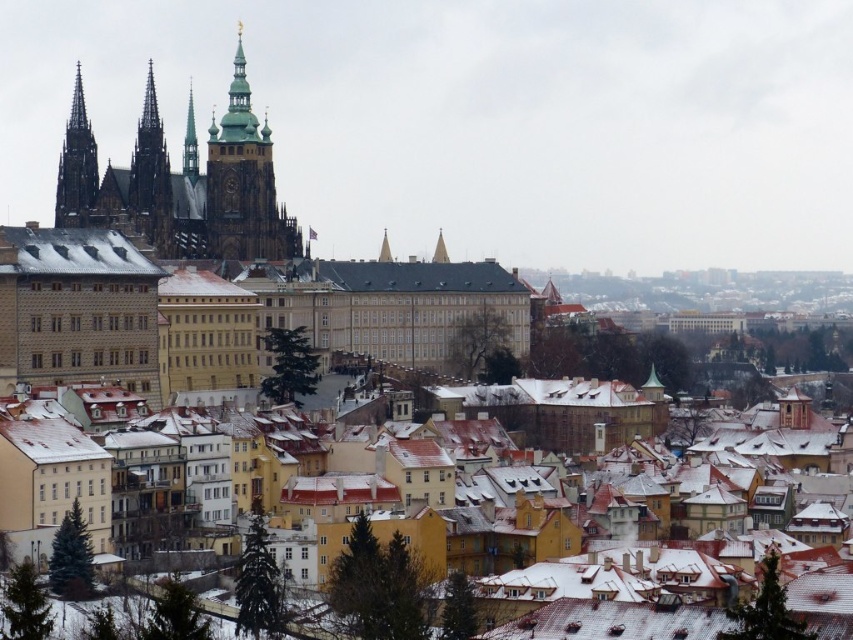
Question: Can you confirm if green stone tower at center is positioned below dark gray stone spire at upper left?

Choices:
 (A) no
 (B) yes

Answer: (B)

Question: Observing the image, what is the correct spatial positioning of smooth stone spire at center-left in reference to green glass spire at center?

Choices:
 (A) above
 (B) below

Answer: (B)

Question: Which point is farther to the camera?

Choices:
 (A) (68, 125)
 (B) (165, 225)
 (C) (254, 122)
 (D) (196, 157)

Answer: (D)

Question: Does green stone tower at center appear on the left side of smooth stone spire at center-left?

Choices:
 (A) no
 (B) yes

Answer: (A)

Question: Which object is positioned closest to the green glass spire at center?

Choices:
 (A) green stone tower at center
 (B) dark gray stone spire at upper left

Answer: (A)

Question: Which object appears closest to the camera in this image?

Choices:
 (A) dark gray stone spire at upper left
 (B) green stone tower at center
 (C) green glass spire at center
 (D) smooth stone spire at center-left

Answer: (D)